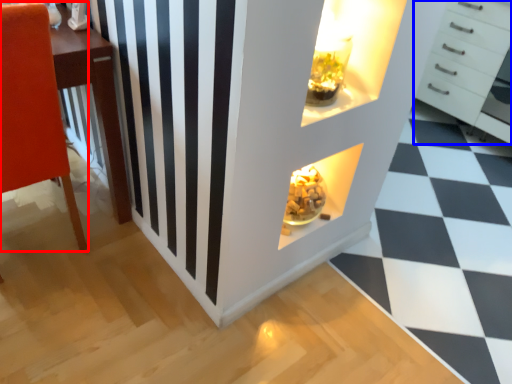
Question: Which object is further to the camera taking this photo, furniture (highlighted by a red box) or chest of drawers (highlighted by a blue box)?

Choices:
 (A) furniture
 (B) chest of drawers

Answer: (B)